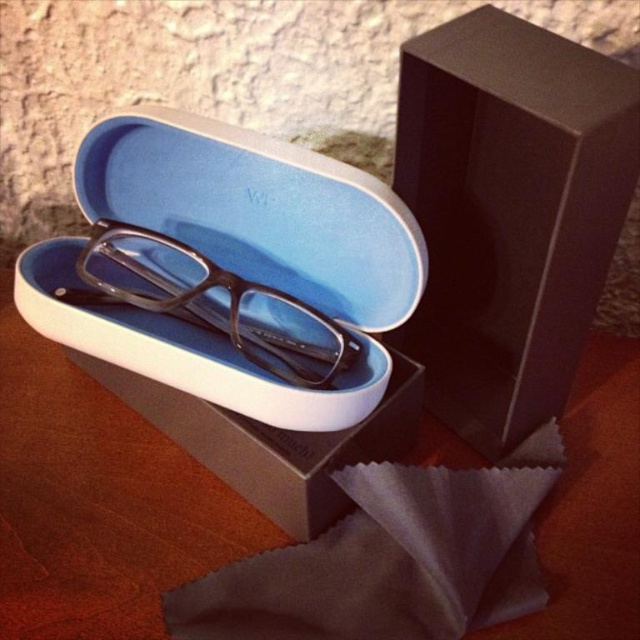
You are trying to pack the matte black glasses at center into the matte black case at center. Based on their sizes, will the glasses fit inside the case?

The matte black case at center is wider than the matte black glasses at center, so the glasses should fit inside the case.

You are trying to determine if the matte black case at center can fit inside the matte black box at upper right. Based on their heights, will it fit vertically?

The matte black case at center is taller than the matte black box at upper right, so it cannot fit vertically inside the box.